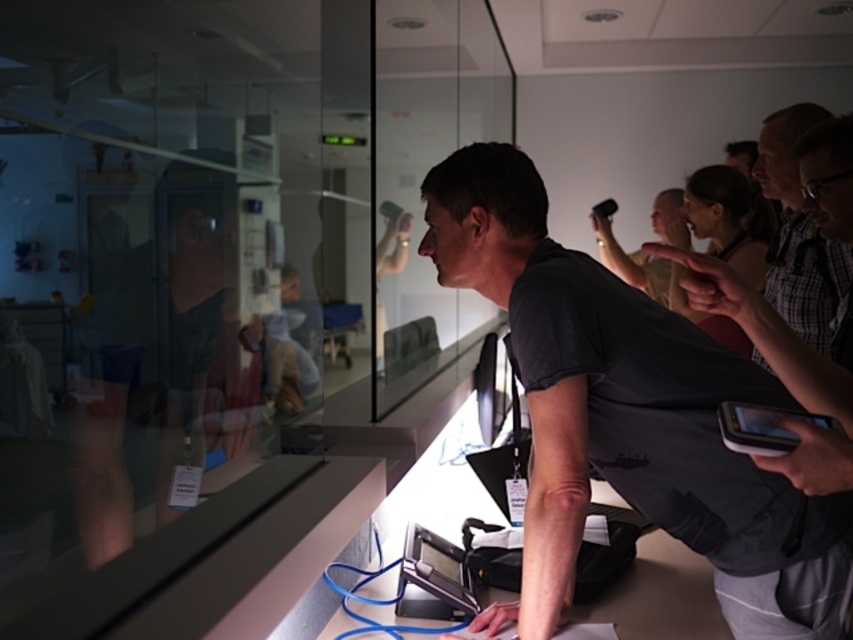
Does dark gray t-shirt at center appear over black plastic phone at upper center?

No, dark gray t-shirt at center is not above black plastic phone at upper center.

Is dark gray t-shirt at center to the left of black plastic phone at upper center from the viewer's perspective?

Yes, dark gray t-shirt at center is to the left of black plastic phone at upper center.

At what (x,y) coordinates should I click in order to perform the action: click on dark gray t-shirt at center. Please return your answer as a coordinate pair (x, y). Looking at the image, I should click on (628, 416).

Is dark gray t-shirt at center above matte black camera at upper right?

No.

Where is `dark gray t-shirt at center`? The height and width of the screenshot is (640, 853). dark gray t-shirt at center is located at coordinates (628, 416).

Does black glossy phone at lower right appear under black plastic phone at upper center?

Yes, black glossy phone at lower right is below black plastic phone at upper center.

Is black glossy phone at lower right bigger than black plastic phone at upper center?

Actually, black glossy phone at lower right might be smaller than black plastic phone at upper center.

Between point (787, 435) and point (595, 216), which one is positioned in front?

Positioned in front is point (787, 435).

This screenshot has width=853, height=640. I want to click on black glossy phone at lower right, so click(x=764, y=428).